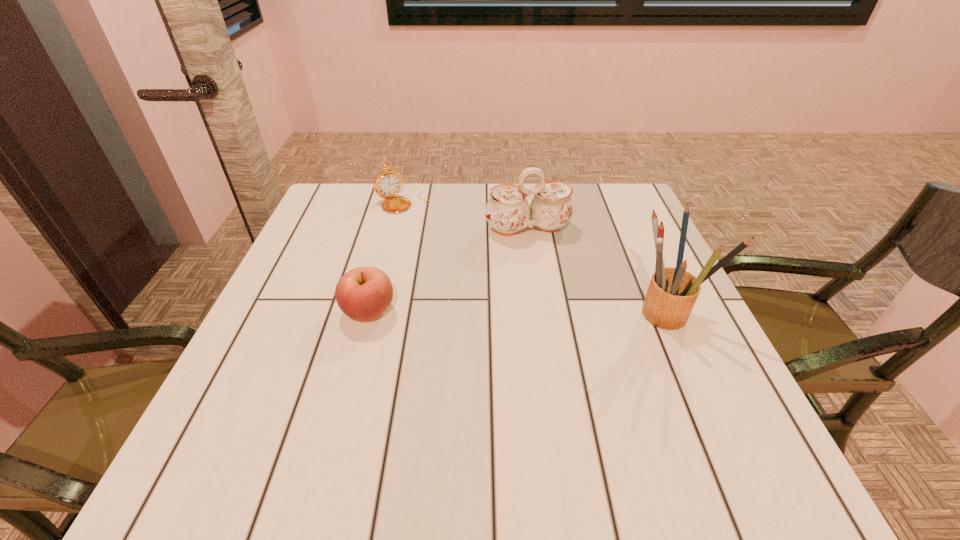
The height and width of the screenshot is (540, 960). Find the location of `vacant space at the far edge`. vacant space at the far edge is located at coordinates (379, 215).

I want to click on vacant space at the near edge of the desktop, so click(x=585, y=390).

Find the location of a particular element. vacant area at the left edge is located at coordinates (290, 267).

Locate an element on the screen. Image resolution: width=960 pixels, height=540 pixels. vacant area at the right edge is located at coordinates (660, 350).

Where is `vacant space at the far left corner`? This screenshot has height=540, width=960. vacant space at the far left corner is located at coordinates (354, 185).

Where is `free space at the near left corner of the desktop`? The height and width of the screenshot is (540, 960). free space at the near left corner of the desktop is located at coordinates (280, 392).

Locate an element on the screen. vacant space at the far right corner of the desktop is located at coordinates 590,203.

Identify the location of vacant area between the apple and the tallest object. (518, 312).

Identify the location of vacant area that lies between the farthest object and the pencil box. This screenshot has height=540, width=960. (536, 256).

Locate an element on the screen. The height and width of the screenshot is (540, 960). empty space between the farthest object and the apple is located at coordinates (386, 256).